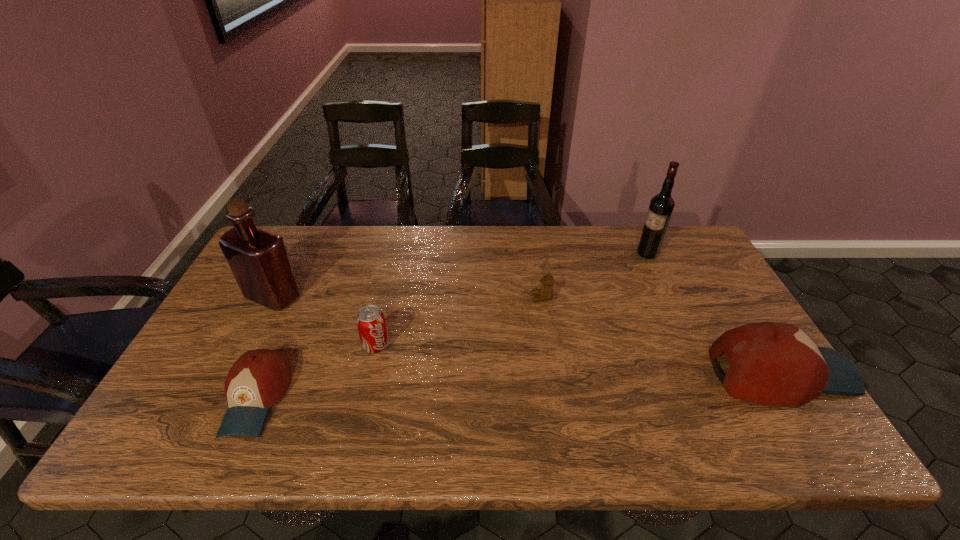
Locate an element on the screen. The width and height of the screenshot is (960, 540). vacant spot for a new baseball_cap to ensure equal spacing is located at coordinates (525, 386).